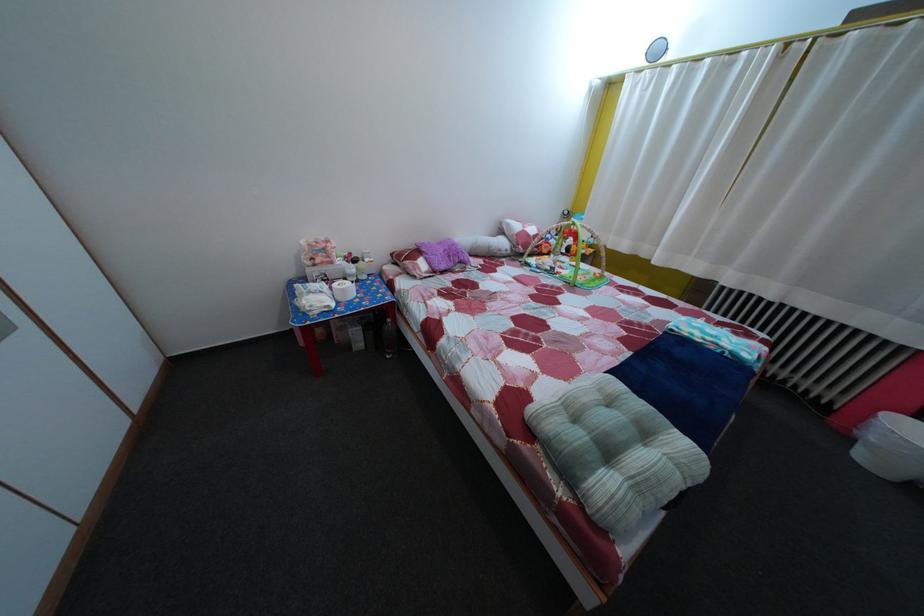
Identify the location of purple furry pillow. (443, 254).